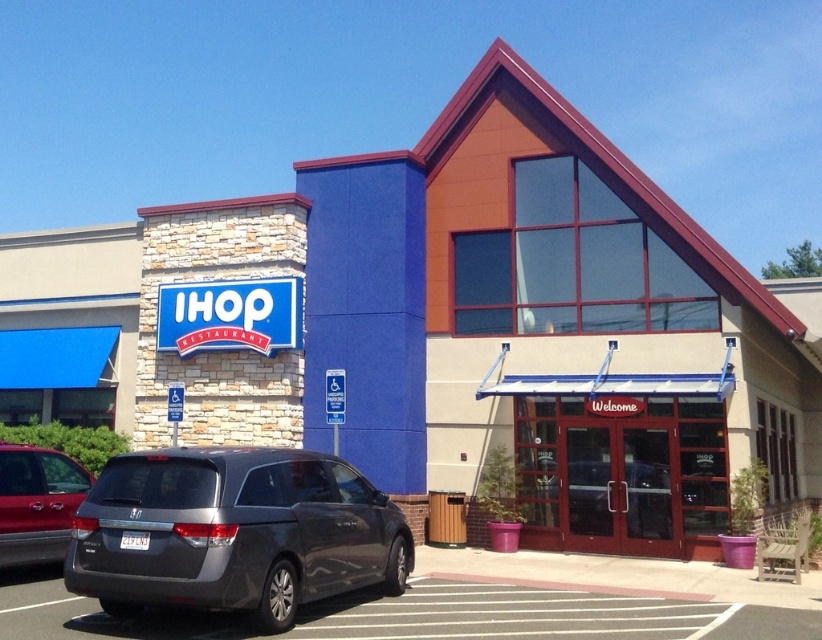
Does satin gray minivan at lower left have a larger size compared to metallic silver minivan at left?

Indeed, satin gray minivan at lower left has a larger size compared to metallic silver minivan at left.

Who is more forward, (213, 465) or (16, 499)?

Point (213, 465) is in front.

Where is `satin gray minivan at lower left`? This screenshot has height=640, width=822. satin gray minivan at lower left is located at coordinates tap(234, 532).

Is gray asphalt parking lot at lower left to the left of metallic silver minivan at left from the viewer's perspective?

Incorrect, gray asphalt parking lot at lower left is not on the left side of metallic silver minivan at left.

Does gray asphalt parking lot at lower left have a greater width compared to metallic silver minivan at left?

Yes, gray asphalt parking lot at lower left is wider than metallic silver minivan at left.

Does point (645, 593) come closer to viewer compared to point (29, 552)?

No, it is not.

In order to click on gray asphalt parking lot at lower left in this screenshot , I will do 437,614.

Between satin gray minivan at lower left and gray asphalt parking lot at lower left, which one has less height?

gray asphalt parking lot at lower left is shorter.

Does satin gray minivan at lower left have a greater height compared to gray asphalt parking lot at lower left?

Indeed, satin gray minivan at lower left has a greater height compared to gray asphalt parking lot at lower left.

Who is more forward, (x=233, y=582) or (x=806, y=618)?

Point (x=233, y=582) is more forward.

This screenshot has width=822, height=640. Find the location of `satin gray minivan at lower left`. satin gray minivan at lower left is located at coordinates (234, 532).